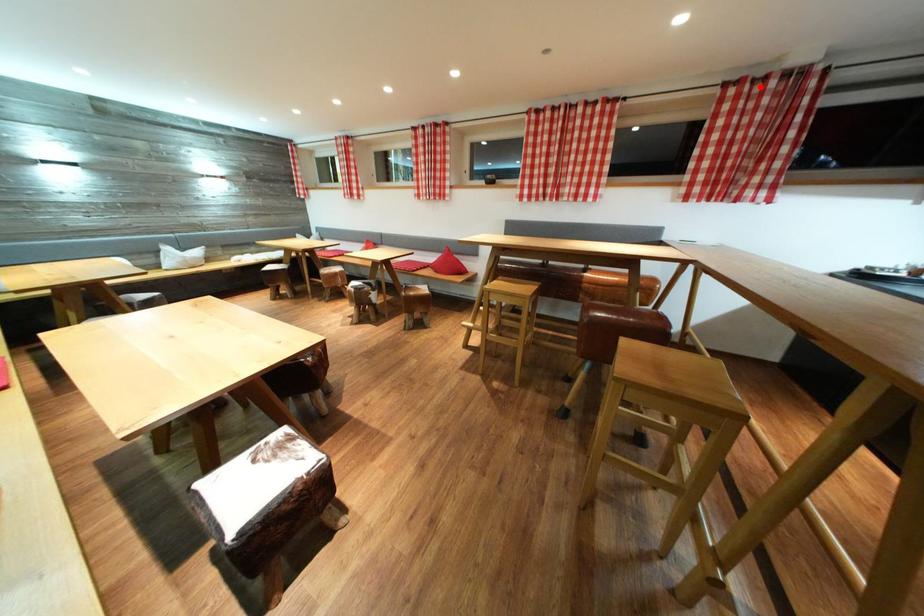
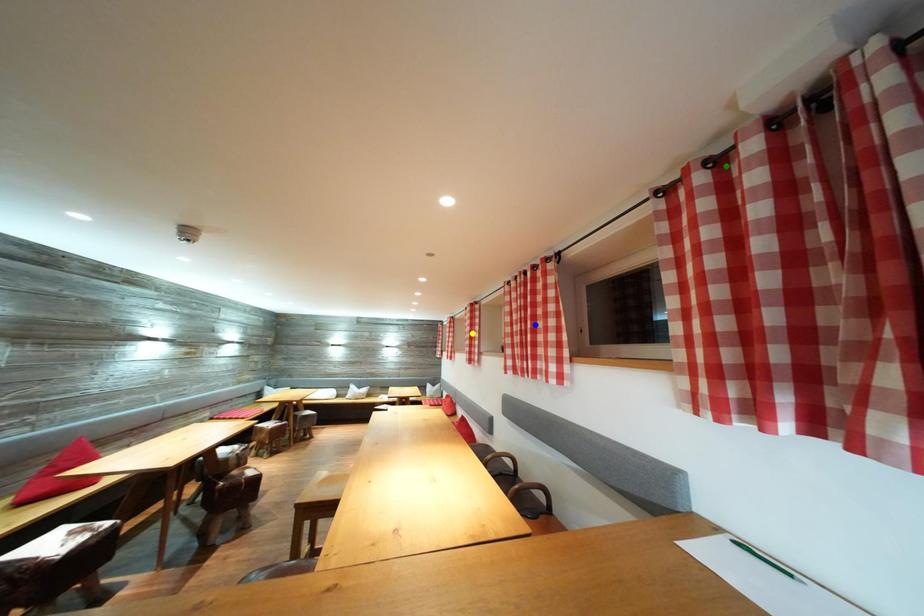
Question: I am providing you with two images of the same scene from different viewpoints. A red point is marked on the first image. You are given multiple points on the second image. Which point in image 2 represents the same 3d spot as the red point in image 1?

Choices:
 (A) green point
 (B) yellow point
 (C) blue point

Answer: (A)